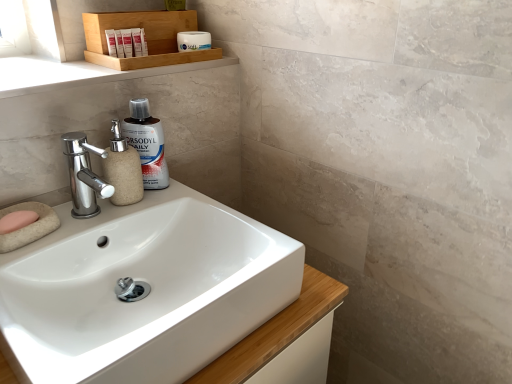
Question: Is wooden tray at upper center to the left or to the right of chrome/metallic faucet at left in the image?

Choices:
 (A) left
 (B) right

Answer: (B)

Question: Is wooden tray at upper center inside the boundaries of chrome/metallic faucet at left, or outside?

Choices:
 (A) inside
 (B) outside

Answer: (B)

Question: Which of these objects is positioned farthest from the wooden tray at upper center?

Choices:
 (A) pink sponge at lower left
 (B) white glossy sink at center
 (C) translucent plastic bottle at center
 (D) beige textured soap dispenser at left
 (E) white matte jar at upper center, the 1th toiletry when ordered from back to front

Answer: (A)

Question: Considering the real-world distances, which object is farthest from the white matte jar at upper center, marked as the third toiletry in a front-to-back arrangement?

Choices:
 (A) chrome/metallic faucet at left
 (B) beige marble tray at upper left
 (C) beige textured soap dispenser at left
 (D) wooden tray at upper center
 (E) translucent plastic bottle at center

Answer: (A)